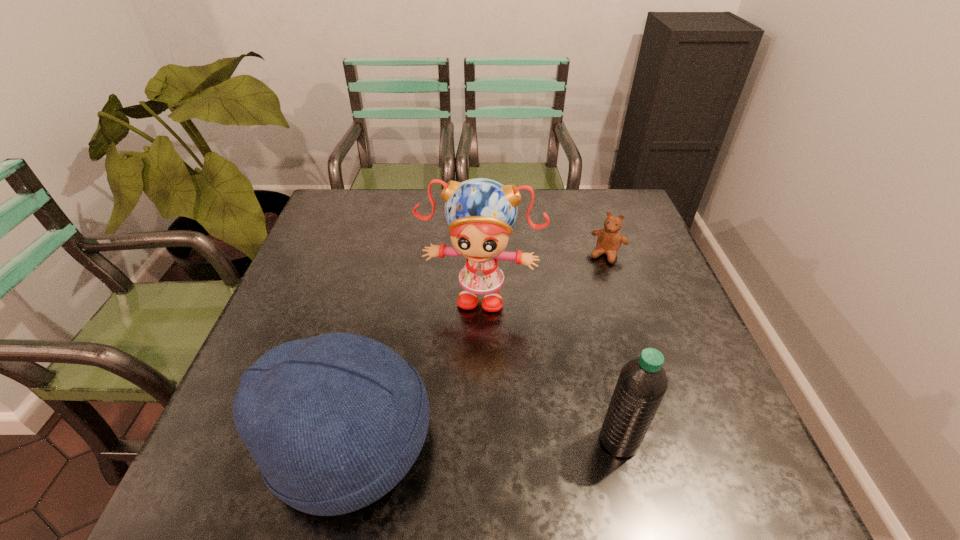
This screenshot has height=540, width=960. Identify the location of skullcap. (334, 422).

Locate an element on the screen. This screenshot has height=540, width=960. the second object from right to left is located at coordinates (642, 383).

This screenshot has height=540, width=960. In order to click on the shortest object in this screenshot , I will do `click(609, 240)`.

Locate an element on the screen. Image resolution: width=960 pixels, height=540 pixels. teddy bear is located at coordinates (609, 240).

Where is `doll`? doll is located at coordinates (480, 212).

This screenshot has height=540, width=960. I want to click on the second farthest object, so click(x=480, y=212).

Find the location of `blank space located on the right of the skullcap`. blank space located on the right of the skullcap is located at coordinates (507, 442).

Locate an element on the screen. free region located on the back of the water bottle is located at coordinates pyautogui.click(x=588, y=314).

The height and width of the screenshot is (540, 960). Identify the location of vacant position located 0.380m on the face of the rightmost object. (554, 365).

Locate an element on the screen. The width and height of the screenshot is (960, 540). vacant space positioned 0.150m on the face of the rightmost object is located at coordinates (586, 299).